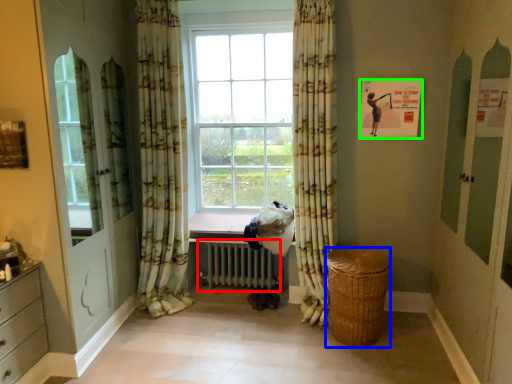
Question: Which is nearer to the radiator (highlighted by a red box)? basket (highlighted by a blue box) or bulletin board (highlighted by a green box).

Choices:
 (A) basket
 (B) bulletin board

Answer: (A)